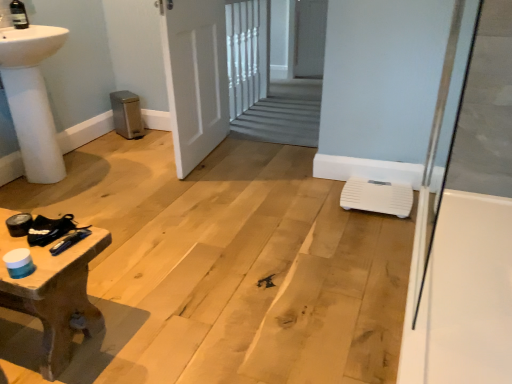
Where is `vacant space in between wooden textured table at lower left and white glossy bath at right`? This screenshot has height=384, width=512. vacant space in between wooden textured table at lower left and white glossy bath at right is located at coordinates (264, 276).